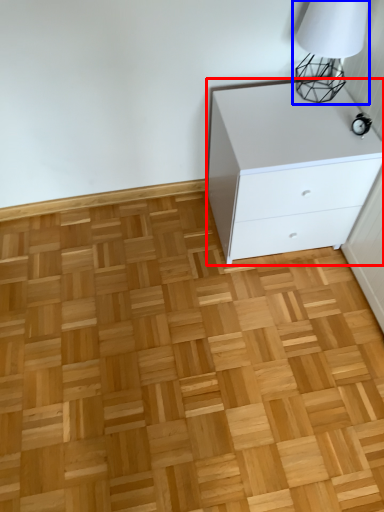
Question: Which object appears closest to the camera in this image, chest of drawers (highlighted by a red box) or table lamp (highlighted by a blue box)?

Choices:
 (A) chest of drawers
 (B) table lamp

Answer: (B)